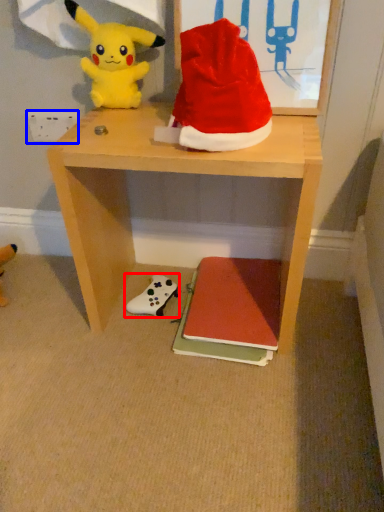
Question: Which object appears closest to the camera in this image, toy (highlighted by a red box) or power outlet (highlighted by a blue box)?

Choices:
 (A) toy
 (B) power outlet

Answer: (A)